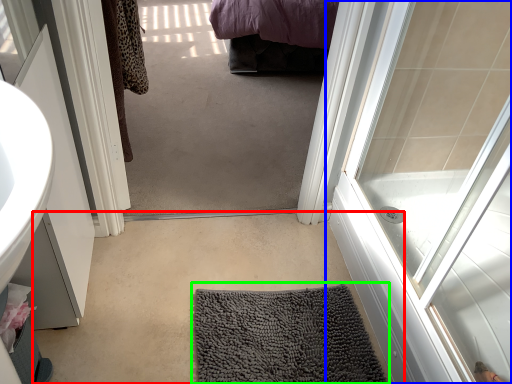
Question: Which is nearer to the plain (highlighted by a red box)? door (highlighted by a blue box) or bath mat (highlighted by a green box).

Choices:
 (A) door
 (B) bath mat

Answer: (B)